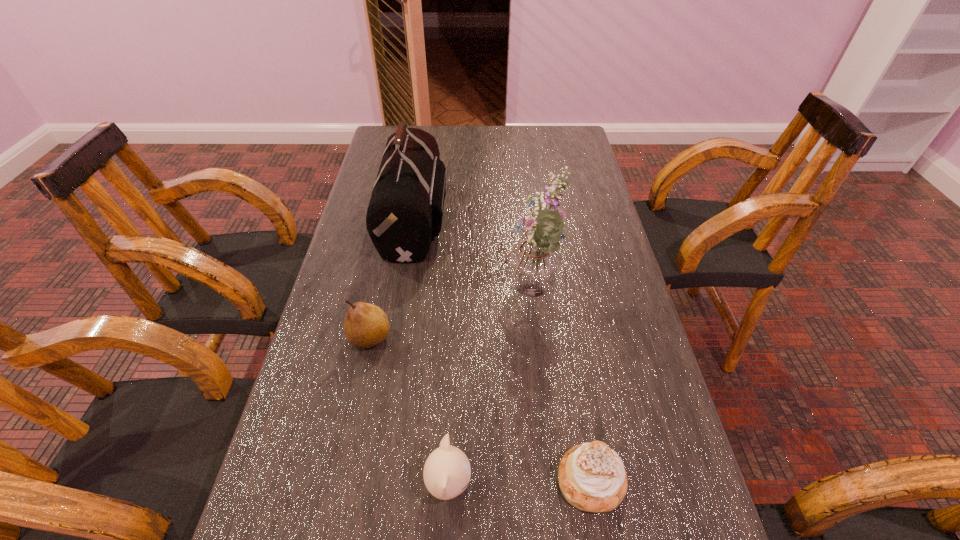
In order to click on the tallest object in this screenshot , I will do `click(533, 270)`.

This screenshot has width=960, height=540. Find the location of `the second tallest object`. the second tallest object is located at coordinates (406, 207).

Where is `the third tallest object`? the third tallest object is located at coordinates (366, 325).

Where is `kitten`? This screenshot has height=540, width=960. kitten is located at coordinates (447, 471).

What are the coordinates of `pastry` in the screenshot? It's located at (592, 478).

Where is `blank area located on the front-facing side of the tallest object`? Image resolution: width=960 pixels, height=540 pixels. blank area located on the front-facing side of the tallest object is located at coordinates (474, 297).

Identify the location of vacant region located 0.160m on the front-facing side of the tallest object. This screenshot has height=540, width=960. (437, 297).

Where is `vacant space positioned on the front-facing side of the tallest object`? vacant space positioned on the front-facing side of the tallest object is located at coordinates (400, 297).

The width and height of the screenshot is (960, 540). I want to click on vacant space positioned on the front pocket of the duffel bag, so click(516, 219).

Locate an element on the screen. The height and width of the screenshot is (540, 960). blank area located on the right of the third shortest object is located at coordinates (414, 338).